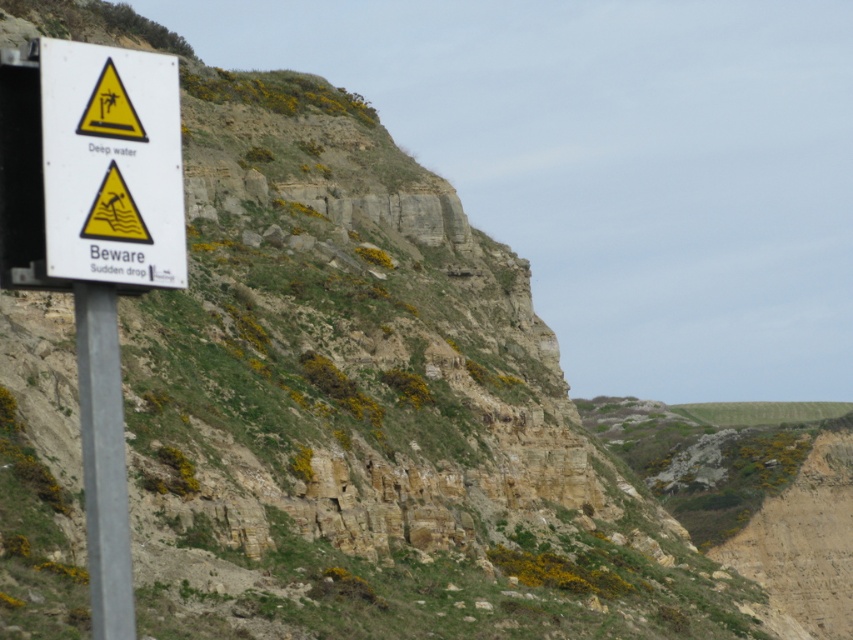
Does point (88, 138) lie behind point (115, 468)?

That is True.

Between point (181, 184) and point (120, 632), which one is positioned in front?

Point (120, 632)

Locate an element on the screen. Image resolution: width=853 pixels, height=640 pixels. white paper sign at left is located at coordinates (108, 257).

Looking at this image, does white paper sign at left appear under white plastic sign at left?

Indeed, white paper sign at left is positioned under white plastic sign at left.

Does point (54, 99) come behind point (171, 83)?

No, (54, 99) is in front of (171, 83).

Does point (114, 554) lie behind point (173, 241)?

No, it is not.

Locate an element on the screen. white paper sign at left is located at coordinates (108, 257).

Can you confirm if white plastic sign at left is positioned below metallic pole at left?

Actually, white plastic sign at left is above metallic pole at left.

This screenshot has width=853, height=640. Find the location of `white plastic sign at left`. white plastic sign at left is located at coordinates (111, 164).

Where is `white plastic sign at left`? This screenshot has height=640, width=853. white plastic sign at left is located at coordinates (111, 164).